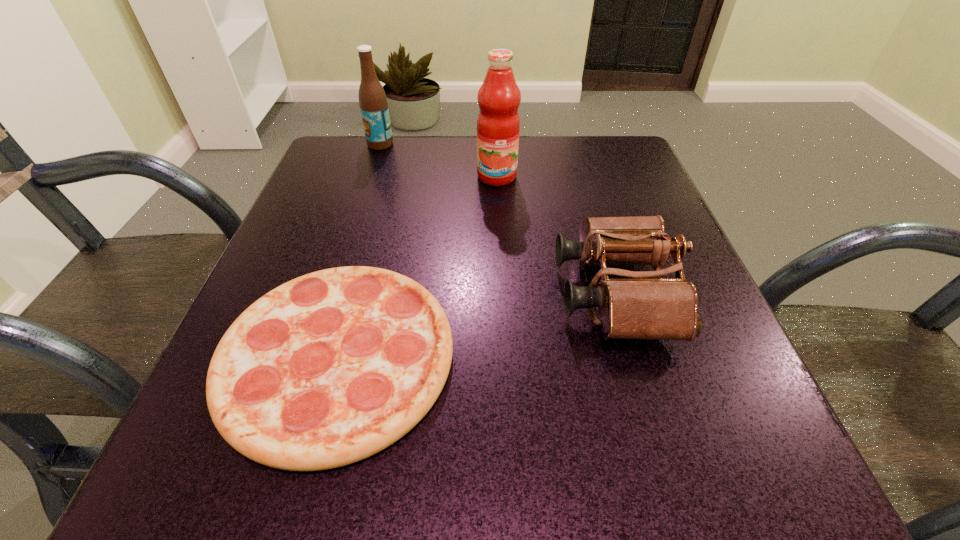
Locate an element on the screen. Image resolution: width=960 pixels, height=540 pixels. the second farthest object is located at coordinates (498, 123).

Locate an element on the screen. Image resolution: width=960 pixels, height=540 pixels. the second object from right to left is located at coordinates (498, 123).

You are a GUI agent. You are given a task and a screenshot of the screen. Output one action in this format:
    pyautogui.click(x=<x>, y=<y>)
    Task: Click on the beer bottle
    The height and width of the screenshot is (540, 960).
    Given the screenshot: What is the action you would take?
    pyautogui.click(x=373, y=103)

Locate an element on the screen. the farthest object is located at coordinates (373, 103).

Locate an element on the screen. the rightmost object is located at coordinates (642, 307).

I want to click on binoculars, so click(642, 307).

At what (x,y) coordinates should I click in order to perform the action: click on the shortest object. Please return your answer as a coordinate pair (x, y). The image size is (960, 540). Looking at the image, I should click on (332, 367).

Where is `free spot located 0.330m on the front label of the third object from left to right`? free spot located 0.330m on the front label of the third object from left to right is located at coordinates (503, 302).

I want to click on vacant space located 0.090m on the left of the farthest object, so click(x=330, y=144).

The image size is (960, 540). I want to click on free space located 0.390m through the eyepieces of the rightmost object, so click(x=323, y=294).